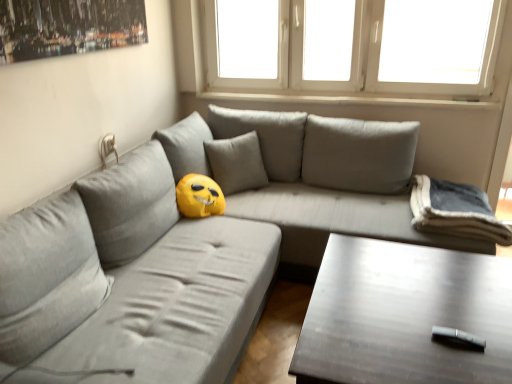
Question: From a real-world perspective, is white plastic window at upper center above or below yellow plush at center, which is the first pillow in left-to-right order?

Choices:
 (A) below
 (B) above

Answer: (B)

Question: In the image, is white plastic window at upper center positioned in front of or behind yellow plush at center, which is the first pillow in left-to-right order?

Choices:
 (A) behind
 (B) front

Answer: (B)

Question: Which is nearer to the white plastic window at upper center?

Choices:
 (A) gray fabric couch at center
 (B) dark wood table at lower right
 (C) gray fleece blanket at right, the 1th pillow in the right-to-left sequence
 (D) yellow plush at center, which is the first pillow in left-to-right order

Answer: (D)

Question: Which is nearer to the gray fleece blanket at right, the 1th pillow in the right-to-left sequence?

Choices:
 (A) gray fabric couch at center
 (B) dark wood table at lower right
 (C) yellow plush at center, positioned as the second pillow in right-to-left order
 (D) white plastic window at upper center

Answer: (B)